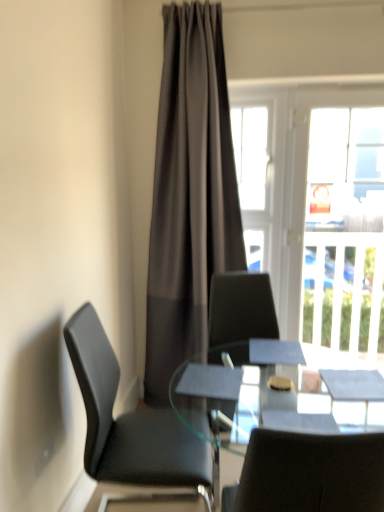
Question: From the image's perspective, is dark gray sheer curtain at center on top of black leather chair at left?

Choices:
 (A) no
 (B) yes

Answer: (B)

Question: Can you confirm if dark gray sheer curtain at center is smaller than black leather chair at left?

Choices:
 (A) yes
 (B) no

Answer: (B)

Question: Does dark gray sheer curtain at center appear on the left side of black leather chair at left?

Choices:
 (A) yes
 (B) no

Answer: (B)

Question: Is dark gray sheer curtain at center far from black leather chair at left?

Choices:
 (A) yes
 (B) no

Answer: (B)

Question: Does dark gray sheer curtain at center lie in front of black leather chair at left?

Choices:
 (A) no
 (B) yes

Answer: (A)

Question: Which is correct: dark gray sheer curtain at center is inside transparent glass table at center, or outside of it?

Choices:
 (A) outside
 (B) inside

Answer: (A)

Question: Does point (200, 264) appear closer or farther from the camera than point (314, 445)?

Choices:
 (A) farther
 (B) closer

Answer: (A)

Question: In terms of width, does dark gray sheer curtain at center look wider or thinner when compared to transparent glass table at center?

Choices:
 (A) wide
 (B) thin

Answer: (B)

Question: Based on their sizes in the image, would you say dark gray sheer curtain at center is bigger or smaller than transparent glass table at center?

Choices:
 (A) big
 (B) small

Answer: (A)

Question: Is dark gray sheer curtain at center inside the boundaries of black leather chair at left, or outside?

Choices:
 (A) outside
 (B) inside

Answer: (A)

Question: Is dark gray sheer curtain at center taller or shorter than black leather chair at left?

Choices:
 (A) short
 (B) tall

Answer: (B)

Question: From a real-world perspective, is dark gray sheer curtain at center above or below black leather chair at left?

Choices:
 (A) above
 (B) below

Answer: (A)

Question: From the image's perspective, is dark gray sheer curtain at center positioned above or below black leather chair at left?

Choices:
 (A) above
 (B) below

Answer: (A)

Question: From a real-world perspective, is black leather chair at left physically located above or below transparent glass table at center?

Choices:
 (A) above
 (B) below

Answer: (A)

Question: Considering the positions of point (175, 476) and point (354, 494), is point (175, 476) closer or farther from the camera than point (354, 494)?

Choices:
 (A) farther
 (B) closer

Answer: (A)